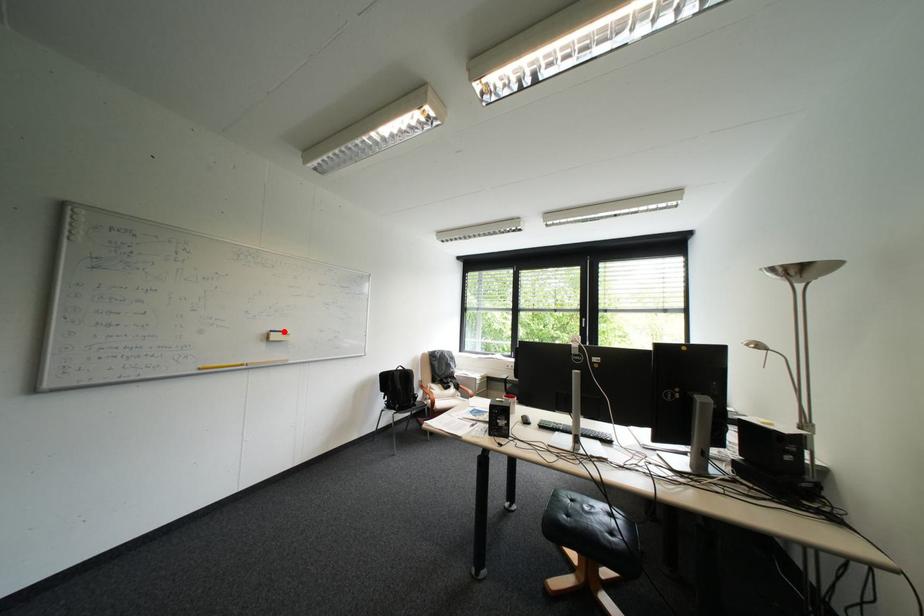
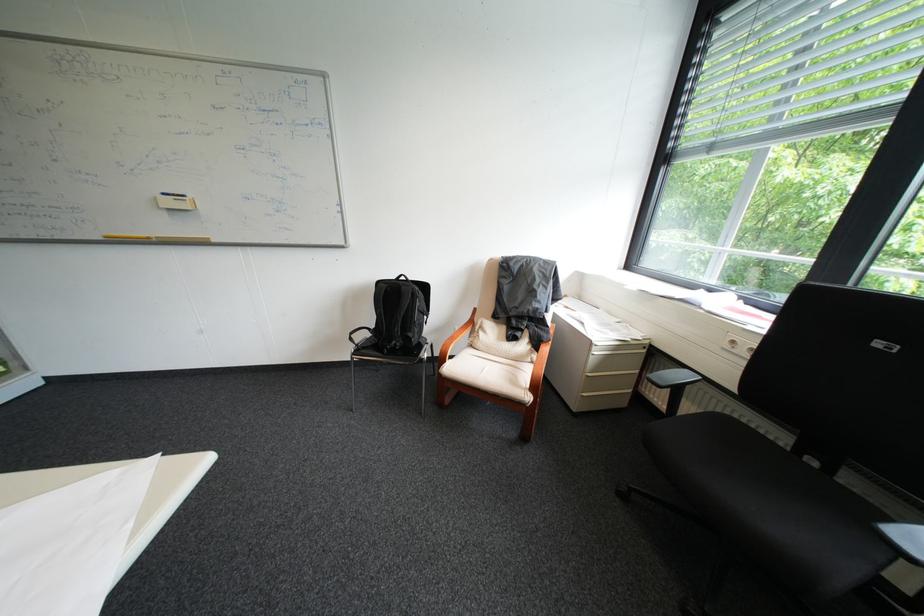
Where in the second image is the point corresponding to the highlighted location from the first image?

(176, 195)